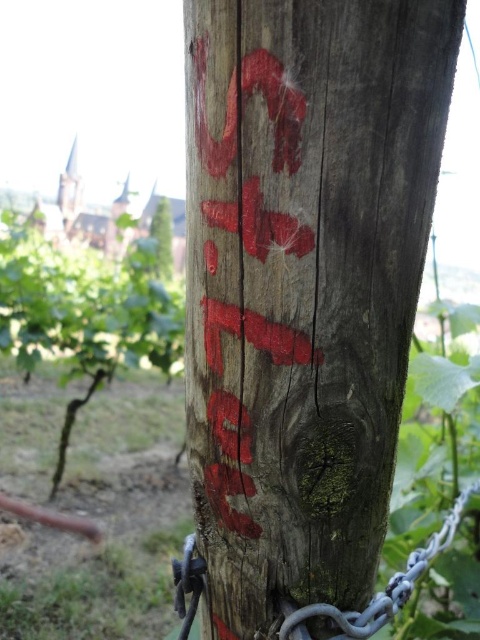
Question: Which object is the farthest from the green rough wood at center?

Choices:
 (A) gray metallic chain at lower center
 (B) smooth brown tree trunk at center
 (C) wooden post at center

Answer: (C)

Question: Is smooth brown tree trunk at center smaller than green rough wood at center?

Choices:
 (A) no
 (B) yes

Answer: (A)

Question: Is smooth brown tree trunk at center below gray metallic chain at lower center?

Choices:
 (A) no
 (B) yes

Answer: (A)

Question: Which object is the closest to the smooth brown tree trunk at center?

Choices:
 (A) wooden post at center
 (B) gray metallic chain at lower center
 (C) green rough wood at center

Answer: (C)

Question: Is wooden post at center positioned in front of green rough wood at center?

Choices:
 (A) no
 (B) yes

Answer: (B)

Question: Which of the following is the closest to the observer?

Choices:
 (A) (173, 346)
 (B) (164, 221)
 (C) (228, 518)
 (D) (309, 611)

Answer: (D)